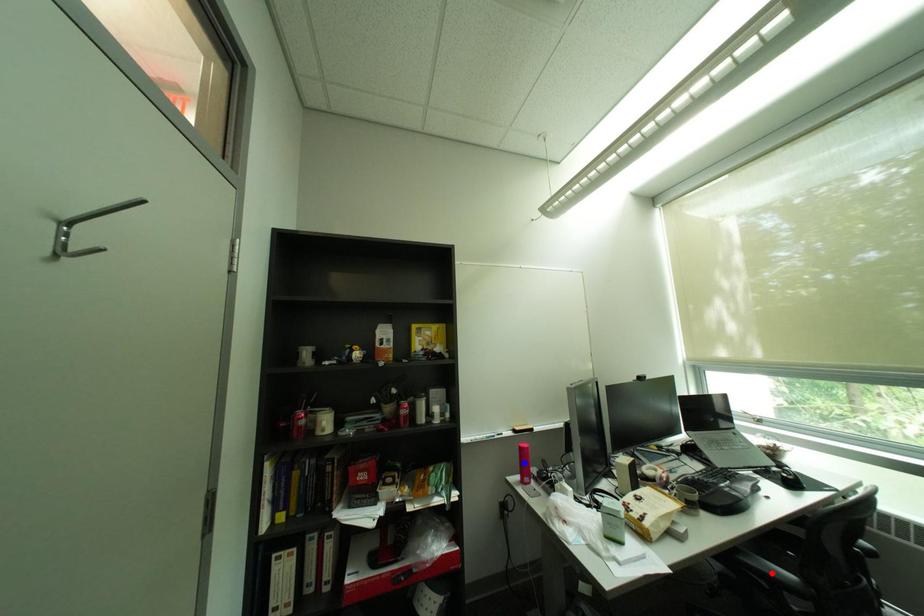
Question: Two points are marked on the image. Which point is closer to the camera?

Choices:
 (A) Blue point is closer.
 (B) Red point is closer.

Answer: (B)